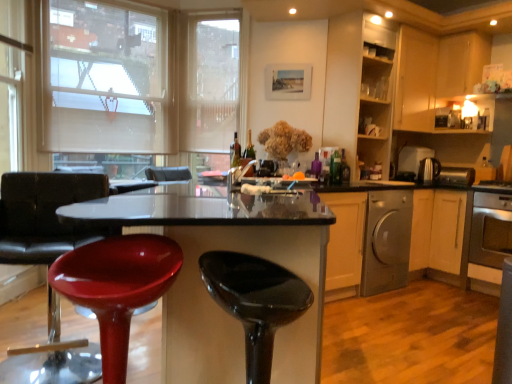
Question: Based on their sizes in the image, would you say metallic silver toaster at right, marked as the 1th appliance in a right-to-left arrangement, is bigger or smaller than matte glass bottle at center, arranged as the third bottle when viewed from the left?

Choices:
 (A) small
 (B) big

Answer: (B)

Question: From the image's perspective, is metallic silver toaster at right, the third appliance viewed from the left, above or below matte glass bottle at center, arranged as the third bottle when viewed from the left?

Choices:
 (A) above
 (B) below

Answer: (B)

Question: Based on their relative distances, which object is nearer to the wooden cabinet at upper right, the third cabinetry from the left?

Choices:
 (A) beige fabric window screen at upper left, which appears as the 1th window screen when viewed from the left
 (B) glossy black bar stool at center
 (C) glossy plastic stool at center, the 2th chair from the right
 (D) translucent glass bottle at center, which is the second bottle in right-to-left order
 (E) wooden cabinet at upper right, which is the third cabinetry in right-to-left order

Answer: (E)

Question: Estimate the real-world distances between objects in this image. Which object is closer to the wooden cabinet at upper right, marked as the second cabinetry in a right-to-left arrangement?

Choices:
 (A) metallic silver toaster at right, the second appliance viewed from the right
 (B) metallic silver toaster at right, the third appliance viewed from the left
 (C) beige fabric window screen at upper left, which appears as the 1th window screen when viewed from the left
 (D) silver metallic oven at lower right
 (E) silver metallic dishwasher at lower right

Answer: (A)